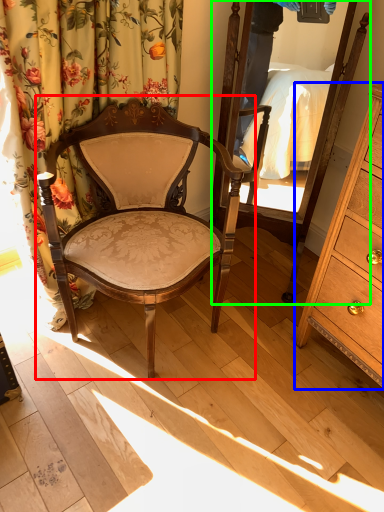
Question: Considering the real-world distances, which object is farthest from chair (highlighted by a red box)? cabinetry (highlighted by a blue box) or mirror (highlighted by a green box)?

Choices:
 (A) cabinetry
 (B) mirror

Answer: (A)